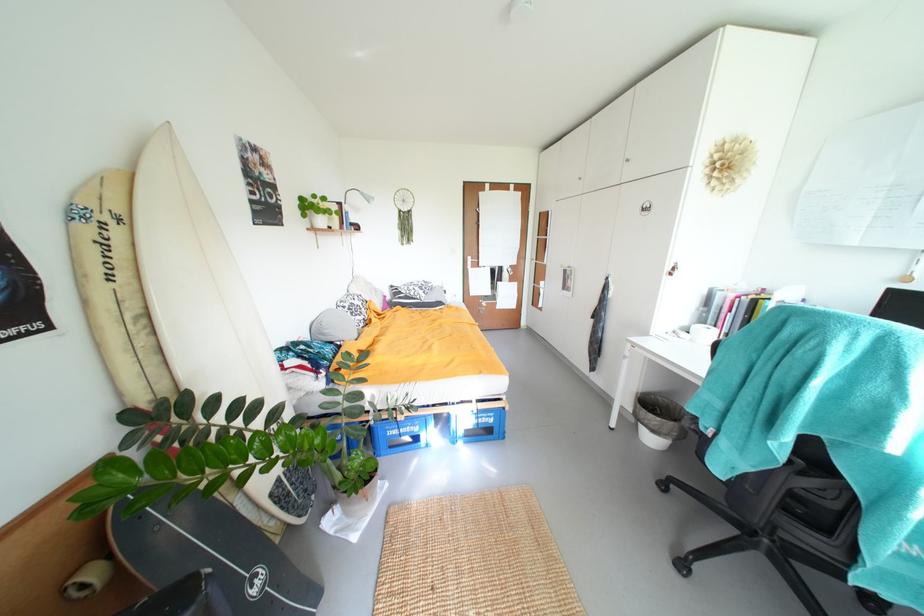
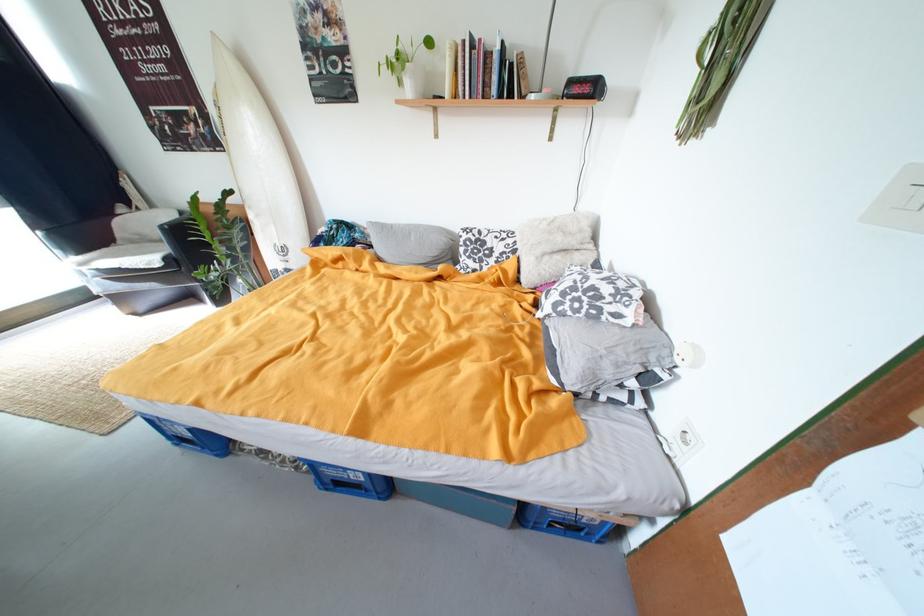
The point at [432,294] is marked in the first image. Where is the corresponding point in the second image?

(564, 306)